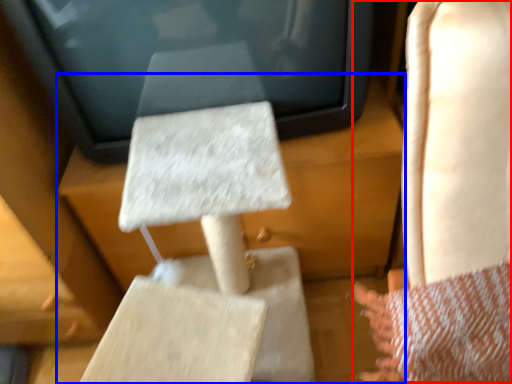
Question: Which point is further to the camera, rocking chair (highlighted by a red box) or furniture (highlighted by a blue box)?

Choices:
 (A) rocking chair
 (B) furniture

Answer: (B)